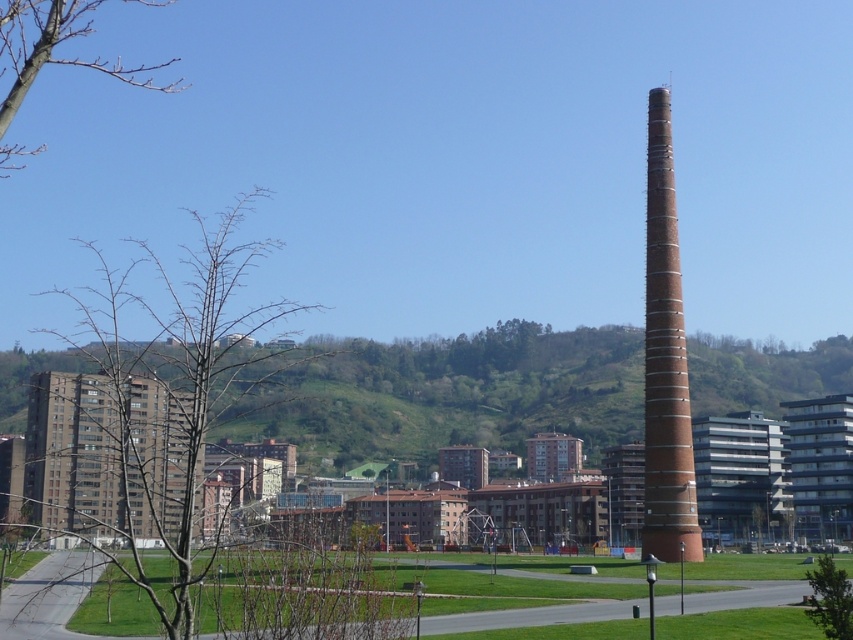
In the scene shown: Between bare branches at left and bare branches at upper left, which one is positioned higher?

Positioned higher is bare branches at upper left.

Can you confirm if bare branches at left is positioned to the left of bare branches at upper left?

Incorrect, bare branches at left is not on the left side of bare branches at upper left.

Is point (91, 508) farther from camera compared to point (10, 163)?

No, it is not.

Identify the location of bare branches at left. This screenshot has height=640, width=853. (166, 396).

Can you confirm if brick tower at right is taller than green leafy tree at lower right?

Yes, brick tower at right is taller than green leafy tree at lower right.

Does brick tower at right appear on the left side of green leafy tree at lower right?

No, brick tower at right is not to the left of green leafy tree at lower right.

Is point (647, 156) positioned after point (805, 609)?

That is True.

Where is `brick tower at right`? brick tower at right is located at coordinates (665, 360).

Can you confirm if bare branches at left is thinner than brown brick building at left?

No, bare branches at left is not thinner than brown brick building at left.

Is bare branches at left bigger than brown brick building at left?

Correct, bare branches at left is larger in size than brown brick building at left.

Is point (161, 342) positioned behind point (27, 408)?

No, (161, 342) is closer to viewer.

At what (x,y) coordinates should I click in order to perform the action: click on bare branches at left. Please return your answer as a coordinate pair (x, y). The width and height of the screenshot is (853, 640). Looking at the image, I should click on (166, 396).